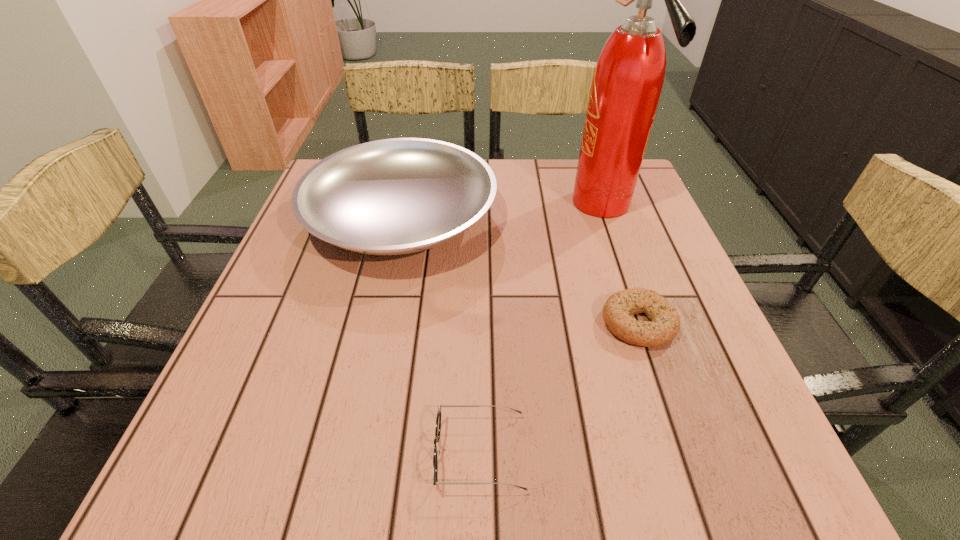
The width and height of the screenshot is (960, 540). What are the coordinates of `vacant space at the left edge of the desktop` in the screenshot? It's located at (291, 314).

At what (x,y) coordinates should I click in order to perform the action: click on vacant region at the right edge of the desktop. Please return your answer as a coordinate pair (x, y). This screenshot has width=960, height=540. Looking at the image, I should click on (604, 220).

Locate an element on the screen. free spot at the near left corner of the desktop is located at coordinates (230, 482).

At what (x,y) coordinates should I click in order to perform the action: click on blank region between the spectacles and the fire extinguisher. Please return your answer as a coordinate pair (x, y). Looking at the image, I should click on (540, 328).

The image size is (960, 540). I want to click on empty location between the bagel and the second tallest object, so 519,270.

The width and height of the screenshot is (960, 540). What are the coordinates of `vacant area that lies between the second tallest object and the spectacles` in the screenshot? It's located at (441, 335).

Where is `vacant point located between the nearest object and the third farthest object`? This screenshot has height=540, width=960. vacant point located between the nearest object and the third farthest object is located at coordinates (559, 388).

You are a GUI agent. You are given a task and a screenshot of the screen. Output one action in this format:
    pyautogui.click(x=<x>, y=<y>)
    Task: Click on the free spot between the second nearest object and the second tallest object
    
    Given the screenshot: What is the action you would take?
    pyautogui.click(x=519, y=270)

Find the location of a particular element. This screenshot has width=960, height=540. vacant area that lies between the nearest object and the second tallest object is located at coordinates (441, 335).

At what (x,y) coordinates should I click in order to perform the action: click on vacant space that is in between the nearest object and the tallest object. Please return your answer as a coordinate pair (x, y). The image size is (960, 540). Looking at the image, I should click on (540, 328).